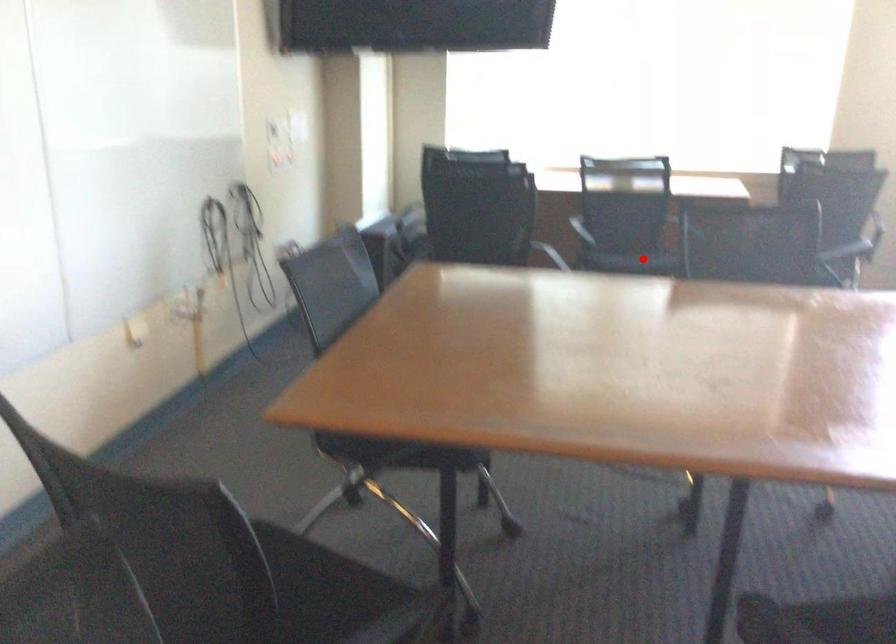
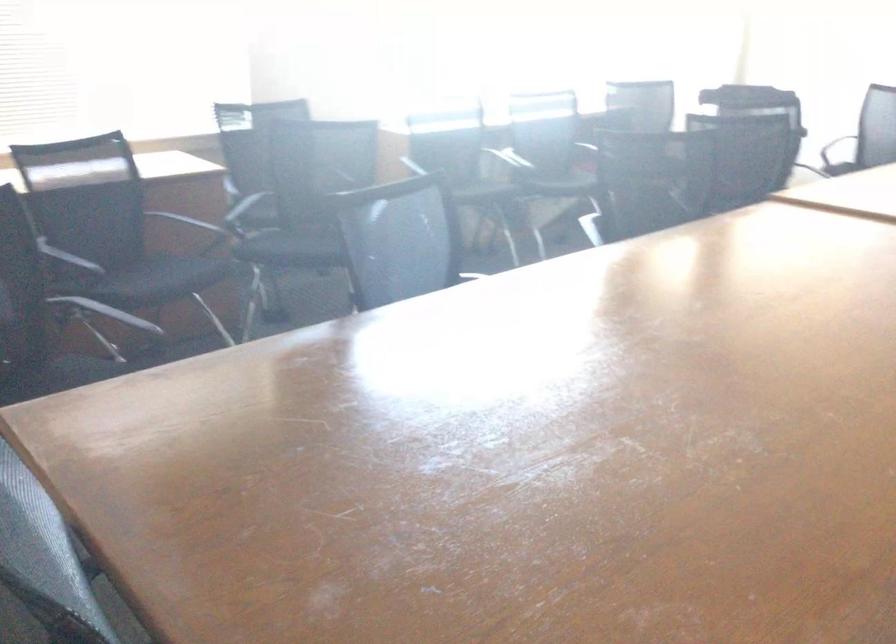
Question: I am providing you with two images of the same scene from different viewpoints. In image1, a red point is highlighted. Considering the same 3D point in image2, which of the following is correct?

Choices:
 (A) It is closer
 (B) It is farther

Answer: (A)